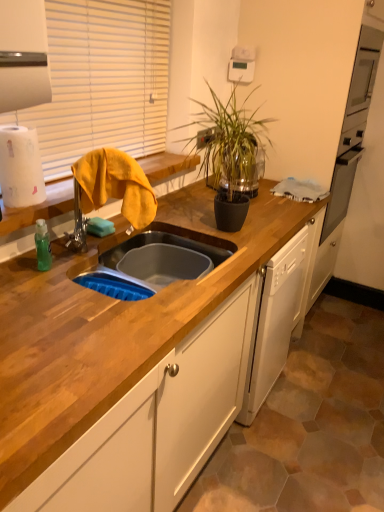
Question: Is wooden at left aimed at yellow fabric at left?

Choices:
 (A) yes
 (B) no

Answer: (B)

Question: From the image's perspective, is wooden at left above yellow fabric at left?

Choices:
 (A) yes
 (B) no

Answer: (A)

Question: From the image's perspective, would you say wooden at left is shown under yellow fabric at left?

Choices:
 (A) no
 (B) yes

Answer: (A)

Question: Is wooden at left completely or partially outside of yellow fabric at left?

Choices:
 (A) yes
 (B) no

Answer: (A)

Question: Is wooden at left positioned in front of yellow fabric at left?

Choices:
 (A) no
 (B) yes

Answer: (A)

Question: From a real-world perspective, is wooden at left on top of yellow fabric at left?

Choices:
 (A) no
 (B) yes

Answer: (A)

Question: Is wooden countertop at center beside yellow fabric at left?

Choices:
 (A) yes
 (B) no

Answer: (B)

Question: Is wooden countertop at center not near yellow fabric at left?

Choices:
 (A) no
 (B) yes

Answer: (A)

Question: Does wooden countertop at center lie in front of yellow fabric at left?

Choices:
 (A) no
 (B) yes

Answer: (B)

Question: Does wooden countertop at center have a greater width compared to yellow fabric at left?

Choices:
 (A) yes
 (B) no

Answer: (A)

Question: From the image's perspective, is wooden countertop at center located above yellow fabric at left?

Choices:
 (A) no
 (B) yes

Answer: (A)

Question: From a real-world perspective, is wooden countertop at center positioned under yellow fabric at left based on gravity?

Choices:
 (A) no
 (B) yes

Answer: (B)

Question: From the image's perspective, is green glossy plant at center located above wooden at left?

Choices:
 (A) yes
 (B) no

Answer: (A)